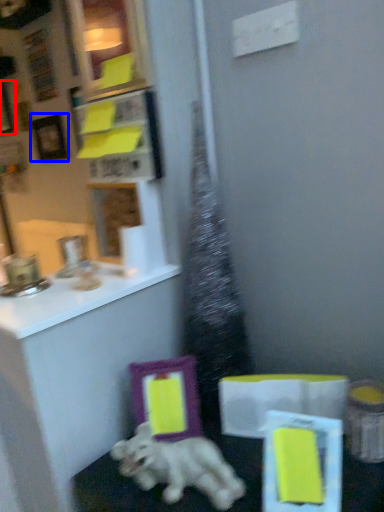
Question: Among these objects, which one is nearest to the camera, picture frame (highlighted by a red box) or picture frame (highlighted by a blue box)?

Choices:
 (A) picture frame
 (B) picture frame

Answer: (B)